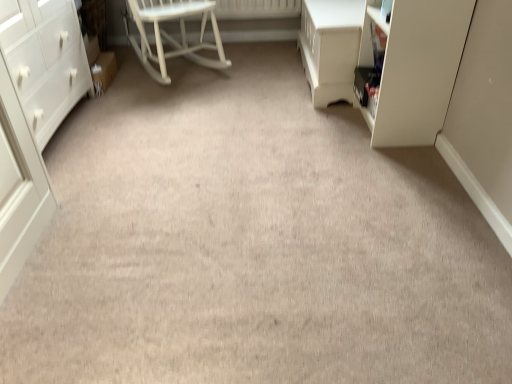
This screenshot has height=384, width=512. Find the location of `vacant area situated to the left side of matte white cabinet at right`. vacant area situated to the left side of matte white cabinet at right is located at coordinates (321, 125).